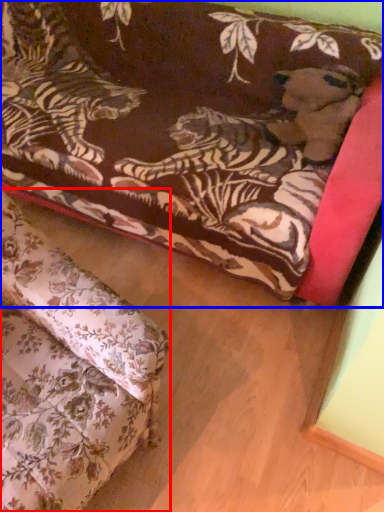
Question: Which object appears closest to the camera in this image, studio couch (highlighted by a red box) or studio couch (highlighted by a blue box)?

Choices:
 (A) studio couch
 (B) studio couch

Answer: (A)